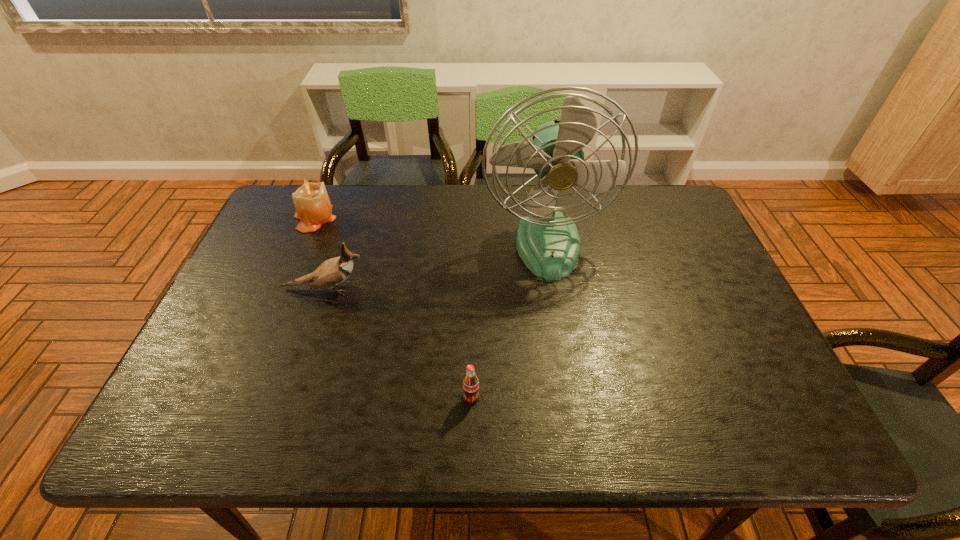
Find the location of `the tallest object`. the tallest object is located at coordinates point(548,242).

This screenshot has width=960, height=540. I want to click on fan, so click(x=548, y=242).

I want to click on bird, so click(333, 271).

This screenshot has height=540, width=960. What are the coordinates of `candle` in the screenshot? It's located at (313, 207).

What are the coordinates of `the nearest object` in the screenshot? It's located at (470, 382).

The width and height of the screenshot is (960, 540). Identify the location of soda. (470, 382).

You are a GUI agent. You are given a task and a screenshot of the screen. Output one action in this format:
    pyautogui.click(x=<x>, y=<y>)
    Task: Click on the free space located 0.180m in front of the tallest object, directing airflow
    
    Given the screenshot: What is the action you would take?
    [x=562, y=333]

The image size is (960, 540). I want to click on vacant space located at the face of the bird, so coord(499,288).

This screenshot has height=540, width=960. What are the coordinates of `free spot located on the front of the candle` in the screenshot? It's located at (288, 282).

Image resolution: width=960 pixels, height=540 pixels. I want to click on vacant space situated on the left of the shortest object, so click(x=298, y=397).